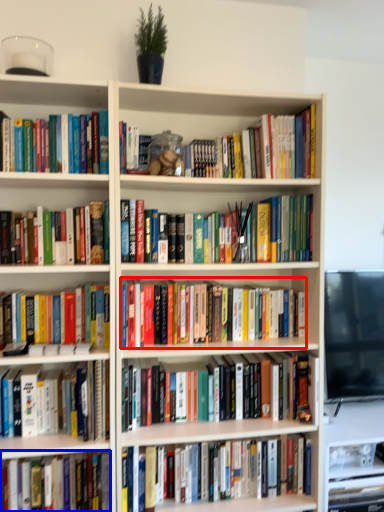
Question: Which object is closer to the camera taking this photo, book (highlighted by a red box) or book (highlighted by a blue box)?

Choices:
 (A) book
 (B) book

Answer: (B)